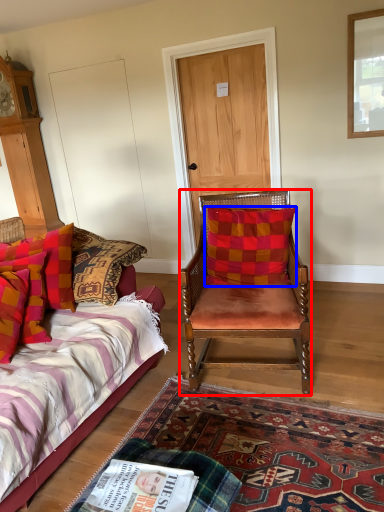
Question: Which object is further to the camera taking this photo, chair (highlighted by a red box) or pillow (highlighted by a blue box)?

Choices:
 (A) chair
 (B) pillow

Answer: (B)